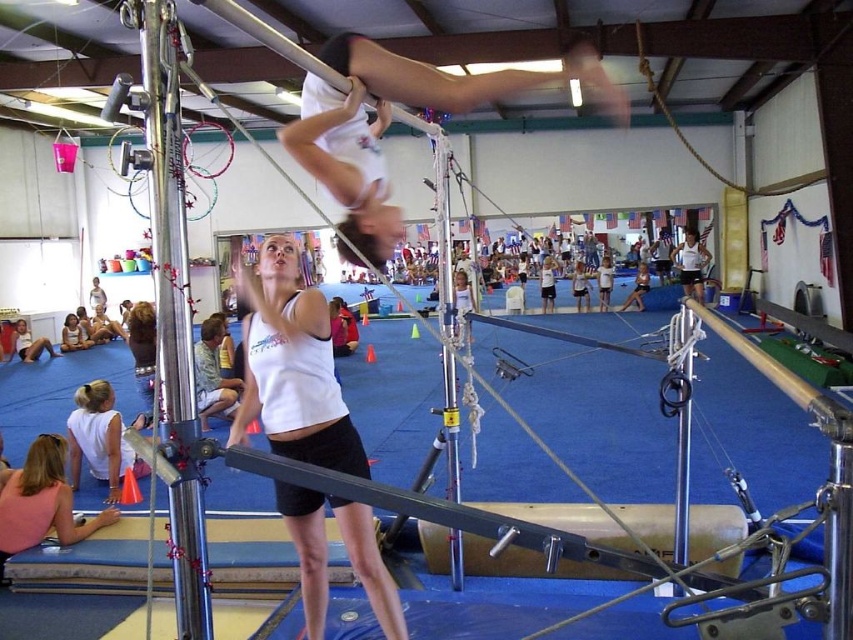
Question: Is polished silver pole at center positioned behind white tank top at lower left?

Choices:
 (A) no
 (B) yes

Answer: (A)

Question: Which point appears farthest from the camera in this image?

Choices:
 (A) (169, 451)
 (B) (242, 17)

Answer: (B)

Question: Does brushed metal pole at center appear under white glossy pole at upper center?

Choices:
 (A) no
 (B) yes

Answer: (B)

Question: Which of the following is the closest to the observer?

Choices:
 (A) white matte tank top at center
 (B) polished silver pole at center
 (C) brushed metal pole at center

Answer: (B)

Question: Does brushed metal pole at center lie behind white glossy pole at upper center?

Choices:
 (A) no
 (B) yes

Answer: (B)

Question: Which of the following is the closest to the observer?

Choices:
 (A) brushed metal pole at center
 (B) white glossy pole at upper center
 (C) white matte tank top at center
 (D) pink sleeveless top at lower left

Answer: (B)